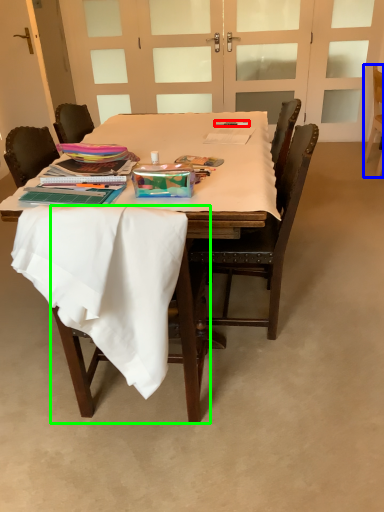
Question: Which object is positioned farthest from pen (highlighted by a red box)? Select from chair (highlighted by a blue box) and chair (highlighted by a green box).

Choices:
 (A) chair
 (B) chair

Answer: (A)